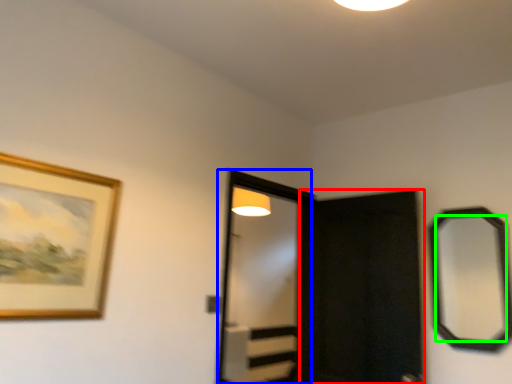
Question: Which is farther away from screen door (highlighted by a red box)? screen door (highlighted by a blue box) or mirror (highlighted by a green box)?

Choices:
 (A) screen door
 (B) mirror

Answer: (A)